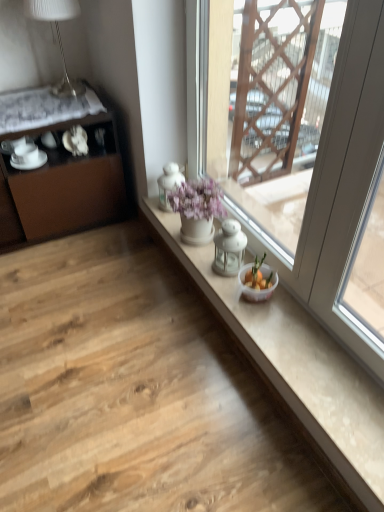
Question: Is white glass window at center not close to brown matte cabinet at left?

Choices:
 (A) no
 (B) yes

Answer: (A)

Question: Does white glass window at center have a lesser height compared to brown matte cabinet at left?

Choices:
 (A) no
 (B) yes

Answer: (A)

Question: Is white glass window at center facing away from brown matte cabinet at left?

Choices:
 (A) yes
 (B) no

Answer: (B)

Question: From a real-world perspective, is white glass window at center positioned under brown matte cabinet at left based on gravity?

Choices:
 (A) yes
 (B) no

Answer: (B)

Question: Can you confirm if white glass window at center is wider than brown matte cabinet at left?

Choices:
 (A) yes
 (B) no

Answer: (B)

Question: Considering the positions of point (14, 241) and point (322, 17), is point (14, 241) closer or farther from the camera than point (322, 17)?

Choices:
 (A) farther
 (B) closer

Answer: (B)

Question: From a real-world perspective, relative to white glass window at center, is brown matte cabinet at left vertically above or below?

Choices:
 (A) below
 (B) above

Answer: (A)

Question: Considering the positions of brown matte cabinet at left and white glass window at center in the image, is brown matte cabinet at left wider or thinner than white glass window at center?

Choices:
 (A) thin
 (B) wide

Answer: (B)

Question: From the image's perspective, is brown matte cabinet at left positioned above or below white glass window at center?

Choices:
 (A) below
 (B) above

Answer: (B)

Question: Is white glossy teacup at left, arranged as the 2th tableware when viewed from the right, wider or thinner than white glass window at center?

Choices:
 (A) wide
 (B) thin

Answer: (A)

Question: Is point (38, 166) closer or farther from the camera than point (264, 243)?

Choices:
 (A) closer
 (B) farther

Answer: (B)

Question: Looking at the image, does white glossy teacup at left, arranged as the 2th tableware when viewed from the right, seem bigger or smaller compared to white glass window at center?

Choices:
 (A) small
 (B) big

Answer: (A)

Question: Considering the relative positions of white glossy teacup at left, the first tableware positioned from the left, and white glass window at center in the image provided, is white glossy teacup at left, the first tableware positioned from the left, to the left or to the right of white glass window at center?

Choices:
 (A) right
 (B) left

Answer: (B)

Question: Is white glossy teacup at left, the first tableware positioned from the left, taller or shorter than white porcelain saucer at left, the 1th tableware from the right?

Choices:
 (A) tall
 (B) short

Answer: (B)

Question: From a real-world perspective, is white glossy teacup at left, the first tableware positioned from the left, physically located above or below white porcelain saucer at left, the 1th tableware from the right?

Choices:
 (A) above
 (B) below

Answer: (B)